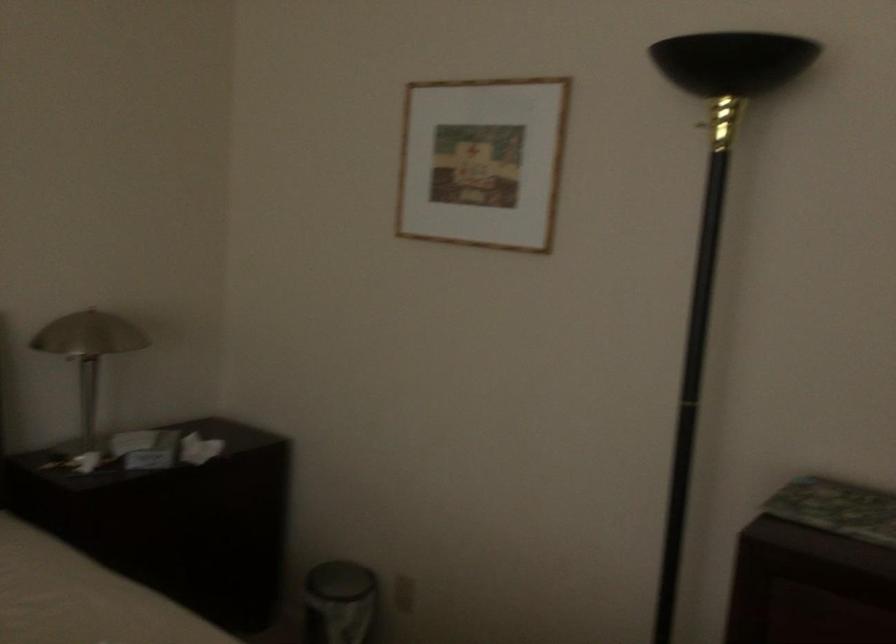
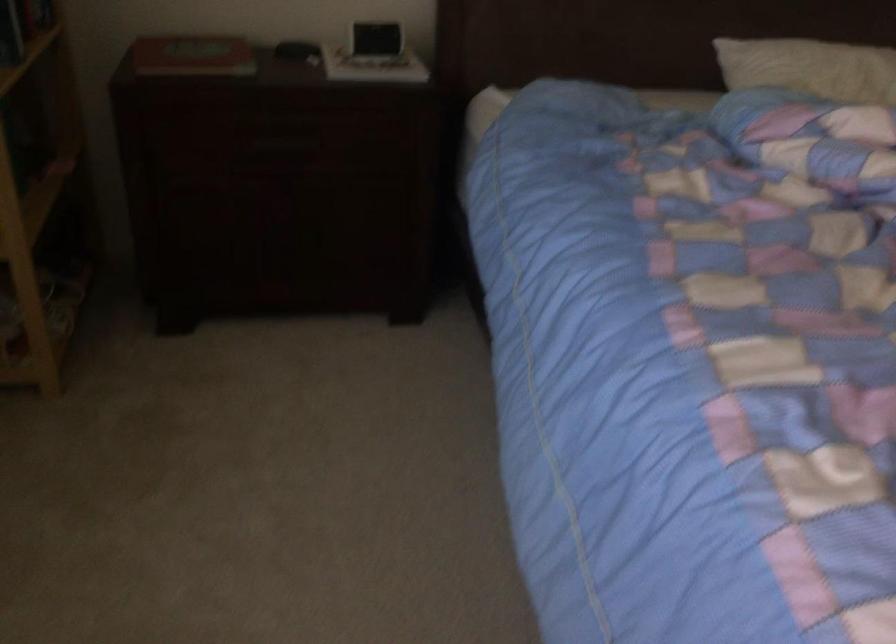
How did the camera likely rotate?

The camera rotated toward left-down.